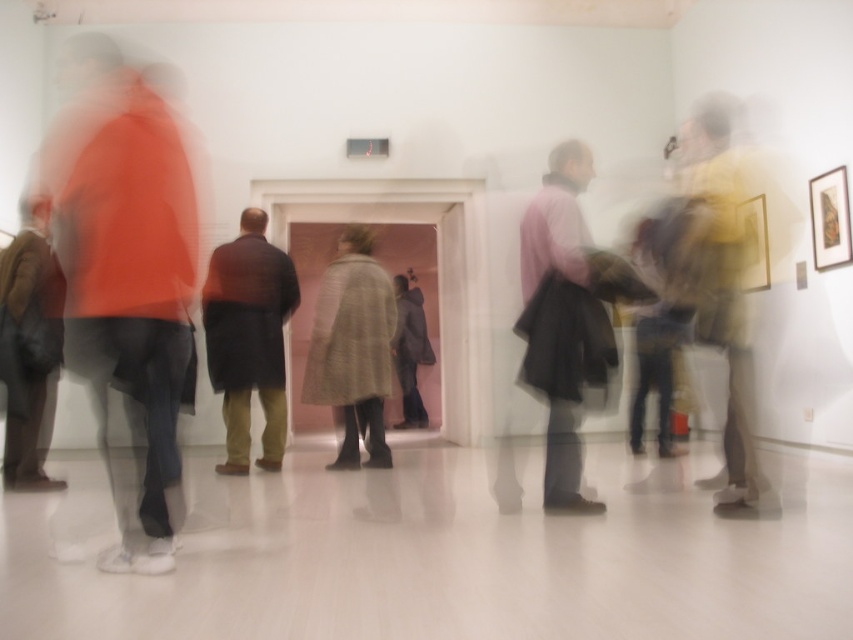
Does brown wool coat at center appear under brown leather jacket at left?

No, brown wool coat at center is not below brown leather jacket at left.

Which of these two, brown wool coat at center or brown leather jacket at left, stands taller?

brown wool coat at center is taller.

Identify the location of brown wool coat at center. The image size is (853, 640). (248, 339).

Does yellow fabric jacket at right have a lesser width compared to light gray wool coat at center?

Correct, yellow fabric jacket at right's width is less than light gray wool coat at center's.

Measure the distance between point (729,413) and camera.

3.34 meters

Does point (706, 145) come behind point (369, 230)?

That is False.

Where is `yellow fabric jacket at right`? This screenshot has height=640, width=853. yellow fabric jacket at right is located at coordinates (724, 294).

Between brown wool coat at center and light gray wool coat at center, which one is positioned higher?

brown wool coat at center is above.

Between point (270, 252) and point (323, 310), which one is positioned behind?

The point (270, 252) is behind.

Who is more forward, (x=216, y=326) or (x=378, y=438)?

Point (x=216, y=326)

Find the location of a particular element. The height and width of the screenshot is (640, 853). brown wool coat at center is located at coordinates (248, 339).